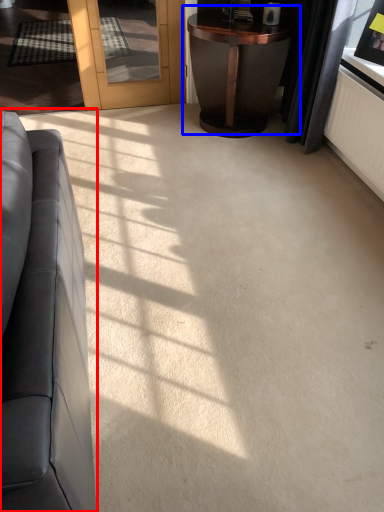
Question: Which point is closer to the camera, studio couch (highlighted by a red box) or table (highlighted by a blue box)?

Choices:
 (A) studio couch
 (B) table

Answer: (A)